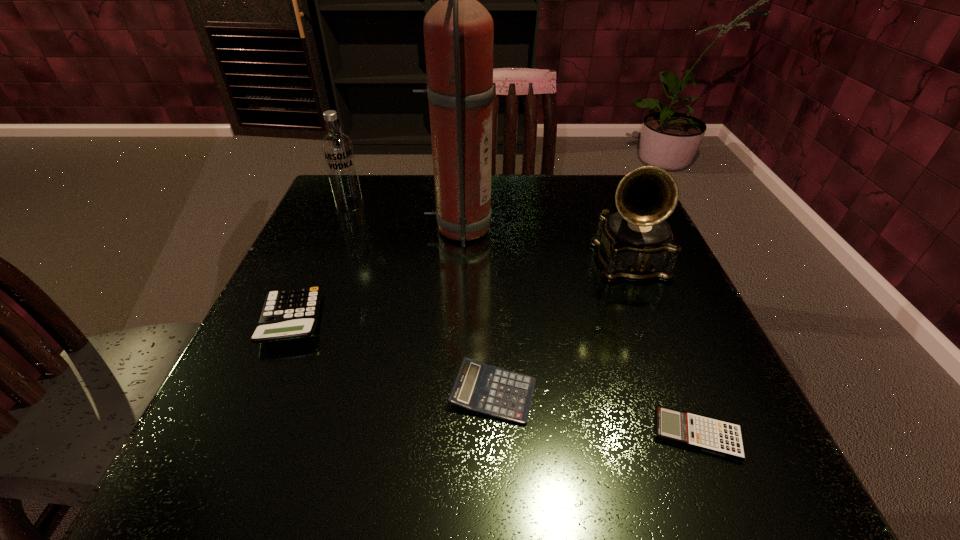
Find the location of `phonograph record that is at the right edge`. phonograph record that is at the right edge is located at coordinates (636, 243).

Find the location of a particular element. This screenshot has height=540, width=960. calculator that is at the right edge is located at coordinates (721, 438).

At what (x,y) coordinates should I click in order to perform the action: click on object that is at the far left corner. Please return your answer as a coordinate pair (x, y). This screenshot has height=540, width=960. Looking at the image, I should click on (337, 149).

This screenshot has width=960, height=540. In order to click on object positioned at the near right corner in this screenshot , I will do `click(721, 438)`.

This screenshot has height=540, width=960. I want to click on free point at the far edge, so click(506, 227).

Where is `vacant space at the near edge of the desktop`? vacant space at the near edge of the desktop is located at coordinates (570, 460).

Find the location of a particular element. The image size is (960, 540). vacant space at the left edge of the desktop is located at coordinates (297, 261).

Locate an element on the screen. The image size is (960, 540). free space at the right edge of the desktop is located at coordinates (657, 297).

In the image, there is a desktop. Identify the location of vacant space at the far right corner. The image size is (960, 540). (610, 198).

The image size is (960, 540). Find the location of `vacant region at the near right corner of the desktop`. vacant region at the near right corner of the desktop is located at coordinates (703, 469).